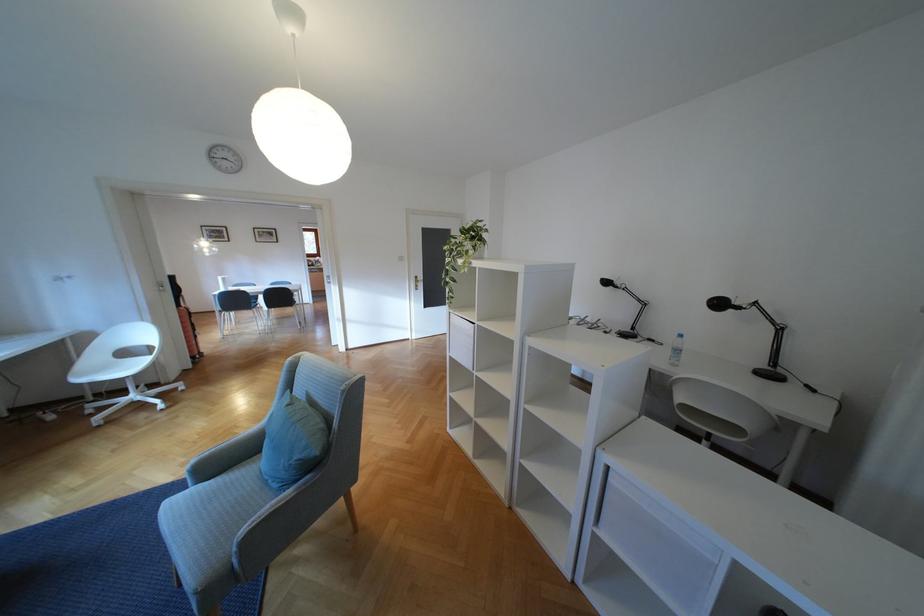
I want to click on white chair sitting surface, so click(100, 369).